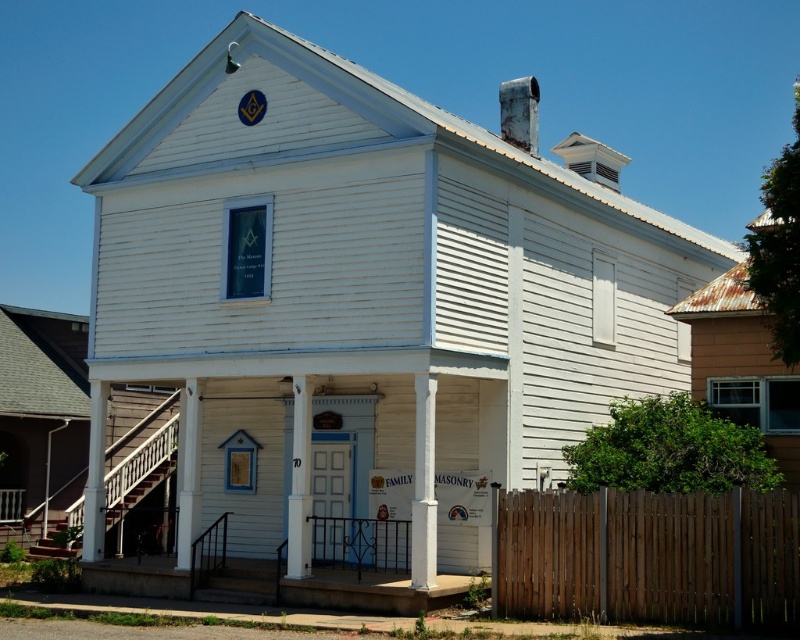
From the picture: You are standing at point (650, 557) in the image. What object is located at this point?

The brown wooden fence at lower right is located at point (650, 557).

You are standing in front of the Masonic lodge and want to touch both the white wood pillar at center and the white painted wood post at center. Which one should you reach for first?

You should reach for the white wood pillar at center first because it is closer to you than the white painted wood post at center.

Consider the image. You are standing in front of the Masonic lodge and want to walk from the brown wooden fence at lower right to the white wood pillar at center. Which direction should you move to reach the pillar?

To reach the white wood pillar at center from the brown wooden fence at lower right, you should move towards the center of the image since the brown wooden fence at lower right is positioned under the white wood pillar at center.